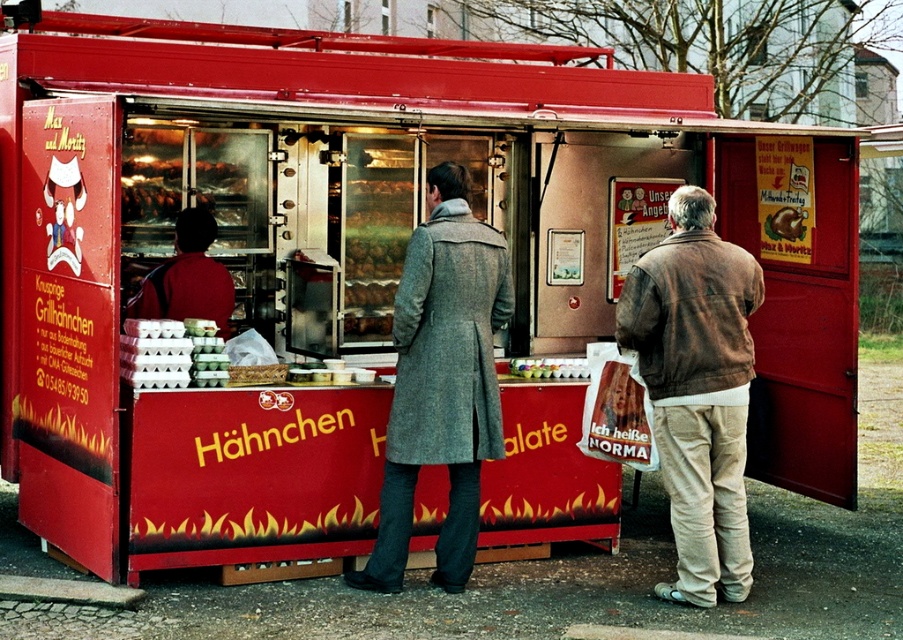
Who is positioned more to the right, brown leather jacket at right or matte plastic cups at center?

Positioned to the right is brown leather jacket at right.

Is brown leather jacket at right shorter than matte plastic cups at center?

No, brown leather jacket at right is not shorter than matte plastic cups at center.

Is point (731, 547) less distant than point (588, 374)?

Yes, it is in front of point (588, 374).

In order to click on brown leather jacket at right in this screenshot , I will do `click(697, 390)`.

Between matte plastic cups at center and smooth chocolate bar at center, which one has more height?

Standing taller between the two is smooth chocolate bar at center.

Is matte plastic cups at center in front of smooth chocolate bar at center?

Yes, matte plastic cups at center is closer to the viewer.

What do you see at coordinates (548, 368) in the screenshot?
I see `matte plastic cups at center` at bounding box center [548, 368].

Identify the location of matte plastic cups at center. (548, 368).

Does brown leather jacket at right appear under smooth chocolate bar at center?

Yes, brown leather jacket at right is below smooth chocolate bar at center.

Which is more to the left, brown leather jacket at right or smooth chocolate bar at center?

From the viewer's perspective, brown leather jacket at right appears more on the left side.

What do you see at coordinates (697, 390) in the screenshot? I see `brown leather jacket at right` at bounding box center [697, 390].

This screenshot has height=640, width=903. I want to click on brown leather jacket at right, so click(x=697, y=390).